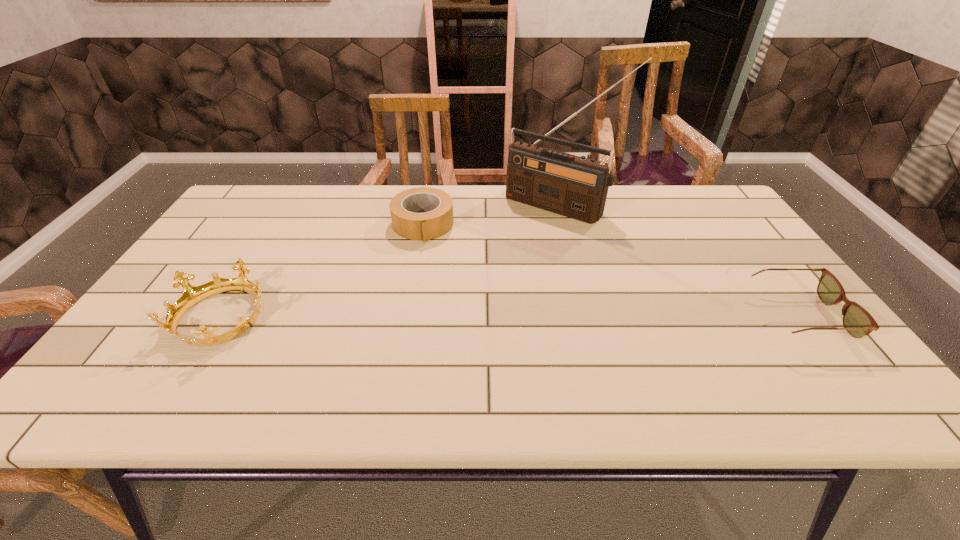
Locate an element on the screen. This screenshot has height=540, width=960. free space that satisfies the following two spatial constraints: 1. on the back side of the second object from right to left; 2. on the right side of the duct tape is located at coordinates (426, 205).